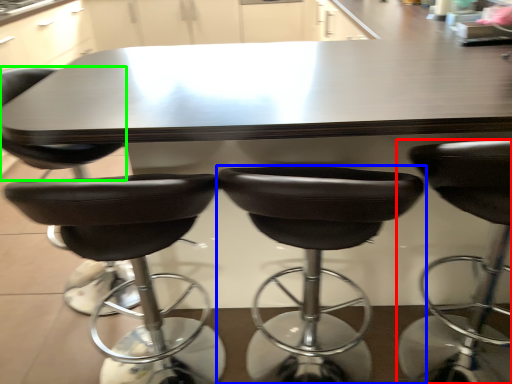
Question: Based on their relative distances, which object is nearer to chair (highlighted by a red box)? Choose from chair (highlighted by a blue box) and chair (highlighted by a green box).

Choices:
 (A) chair
 (B) chair

Answer: (A)